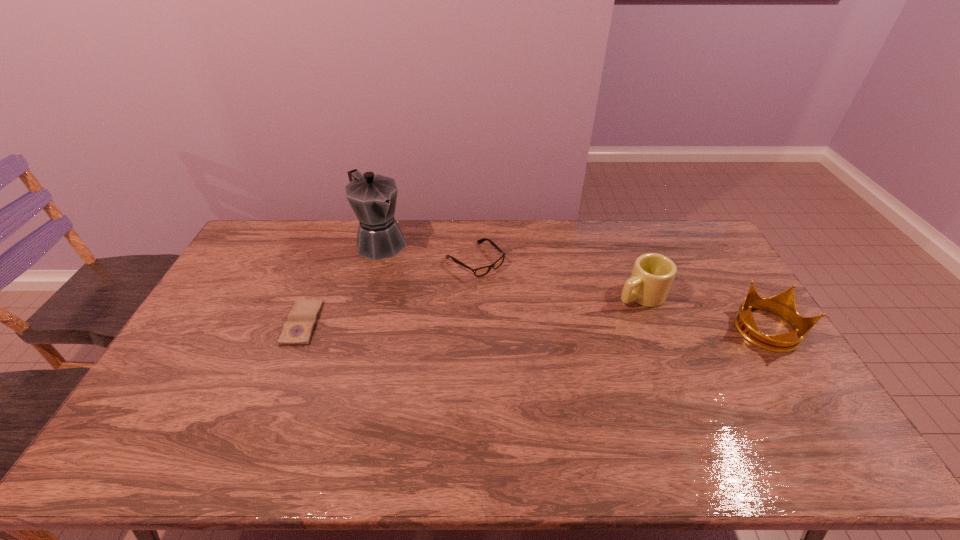
Identify the location of coffeepot present at the far edge. The image size is (960, 540). (372, 197).

In order to click on object that is at the right edge in this screenshot , I will do `click(783, 304)`.

Locate an element on the screen. This screenshot has width=960, height=540. vacant space at the far edge of the desktop is located at coordinates (434, 237).

What are the coordinates of `vacant region at the near edge` in the screenshot? It's located at (726, 422).

Where is `free space at the left edge of the desktop`? This screenshot has height=540, width=960. free space at the left edge of the desktop is located at coordinates 244,286.

At what (x,y) coordinates should I click in order to perform the action: click on vacant area at the right edge. Please return your answer as a coordinate pair (x, y). Looking at the image, I should click on (773, 359).

Find the location of a particular element. free space at the far right corner of the desktop is located at coordinates (673, 234).

At what (x,y) coordinates should I click in order to perform the action: click on vacant space that's between the tallest object and the mug. Please return your answer as a coordinate pair (x, y). Looking at the image, I should click on (511, 268).

You are a GUI agent. You are given a task and a screenshot of the screen. Output one action in this format:
    pyautogui.click(x=<x>, y=<y>)
    Task: Click on the free space between the second shortest object and the crown
    The image size is (960, 540).
    Given the screenshot: What is the action you would take?
    pyautogui.click(x=620, y=295)

Find the location of a particular element. vacant area that lies between the second object from left to right and the rightmost object is located at coordinates (573, 286).